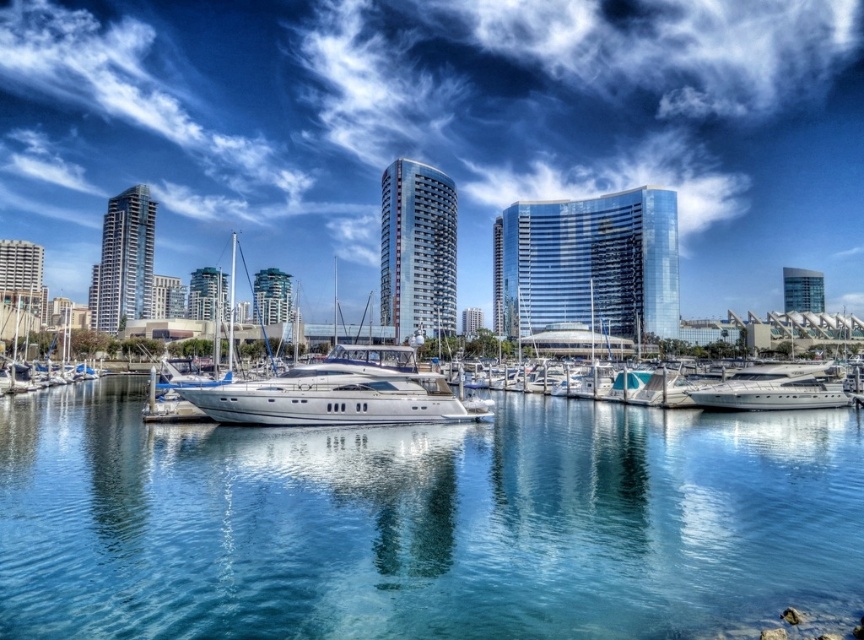
You are a photographer planning to capture the white glossy yacht at center and the glassy blue skyscraper at upper right in a single shot. Based on their positions, which object should you focus on first to ensure both are in frame?

The white glossy yacht at center is located below the glassy blue skyscraper at upper right, so you should focus on the glassy blue skyscraper at upper right first to ensure both are in frame.

You are a photographer standing at the edge of the waterfront, aiming to capture the two points in the scene. Which point, point (372,403) or point (786,296), appears larger in your photo?

Point (372,403) appears larger in the photo because it is closer to the camera than point (786,296).